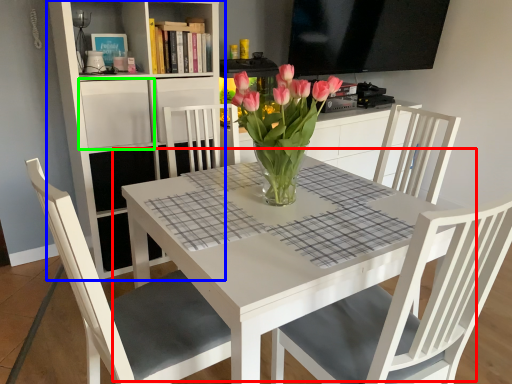
Question: Considering the real-world distances, which object is closest to table (highlighted by a red box)? shelf (highlighted by a blue box) or shelf (highlighted by a green box).

Choices:
 (A) shelf
 (B) shelf

Answer: (A)